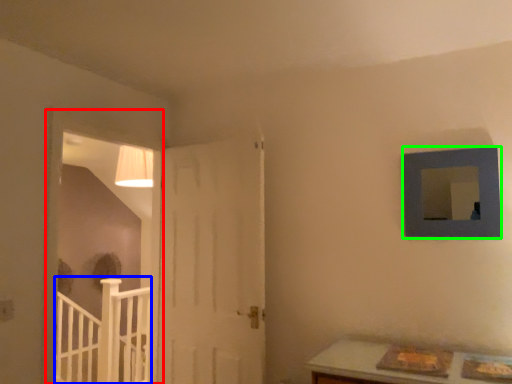
Question: Considering the real-world distances, which object is farthest from window frame (highlighted by a red box)? rail (highlighted by a blue box) or picture frame (highlighted by a green box)?

Choices:
 (A) rail
 (B) picture frame

Answer: (B)